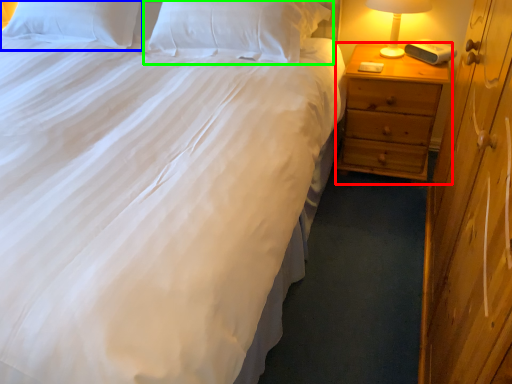
Question: Which object is the closest to the nightstand (highlighted by a red box)? Choose among these: pillow (highlighted by a blue box) or pillow (highlighted by a green box).

Choices:
 (A) pillow
 (B) pillow

Answer: (B)